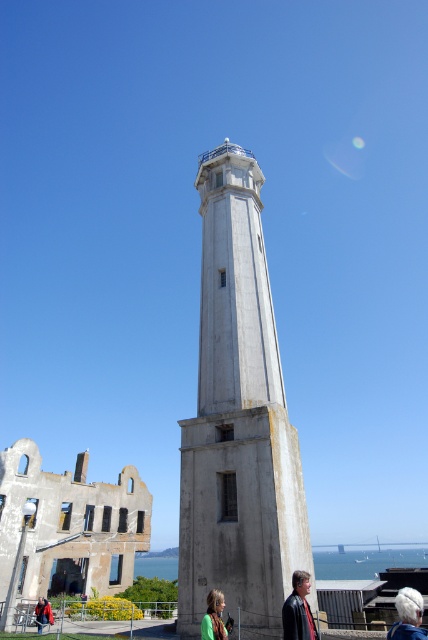
Between white hair at lower right and green fabric jacket at lower center, which one has less height?

With less height is green fabric jacket at lower center.

Is point (422, 605) farther from camera compared to point (214, 612)?

No.

Describe the element at coordinates (407, 616) in the screenshot. I see `white hair at lower right` at that location.

Find the location of a particular element. This screenshot has width=428, height=640. white hair at lower right is located at coordinates (407, 616).

The height and width of the screenshot is (640, 428). What do you see at coordinates (299, 609) in the screenshot? I see `black leather jacket at lower right` at bounding box center [299, 609].

Is point (296, 580) behind point (45, 608)?

No, it is not.

I want to click on black leather jacket at lower right, so click(299, 609).

Does white concrete tower at center have a lesser width compared to white hair at lower right?

Yes.

Between point (211, 288) and point (407, 634), which one is positioned behind?

The point (211, 288) is more distant.

The image size is (428, 640). Identify the location of white concrete tower at center. (237, 420).